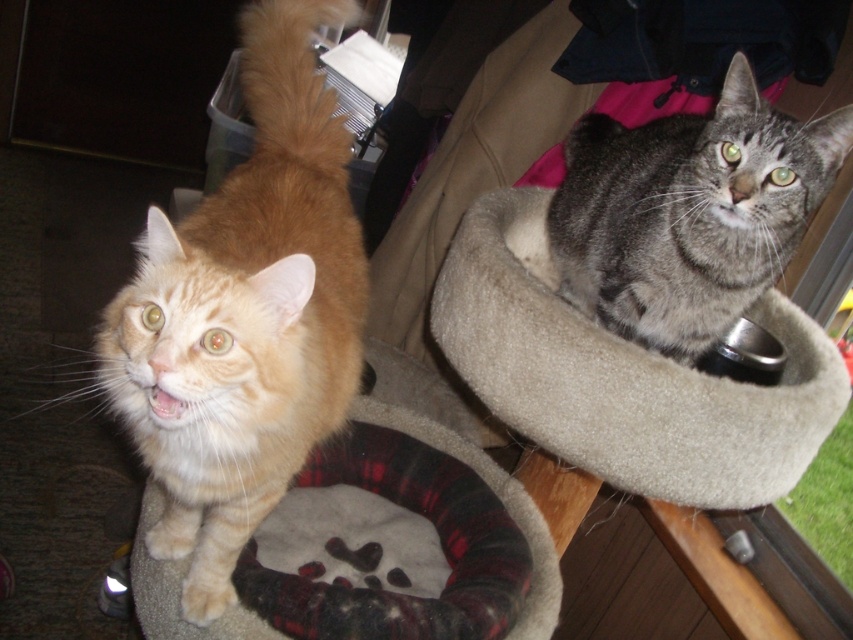
Question: Is gray tabby cat at upper right to the left of plaid fabric cat bed at center from the viewer's perspective?

Choices:
 (A) yes
 (B) no

Answer: (B)

Question: Which object appears farthest from the camera in this image?

Choices:
 (A) orange fur cat at left
 (B) gray tabby cat at upper right
 (C) beige soft cat bed at upper right
 (D) plaid fabric cat bed at center

Answer: (D)

Question: Which point is farther to the camera?

Choices:
 (A) (521, 205)
 (B) (126, 372)
 (C) (639, 292)
 (D) (245, 632)

Answer: (A)

Question: Is beige soft cat bed at upper right smaller than gray tabby cat at upper right?

Choices:
 (A) no
 (B) yes

Answer: (A)

Question: Is gray tabby cat at upper right thinner than plaid fabric cat bed at center?

Choices:
 (A) yes
 (B) no

Answer: (A)

Question: Which point is closer to the camera taking this photo?

Choices:
 (A) (529, 294)
 (B) (660, 177)

Answer: (A)